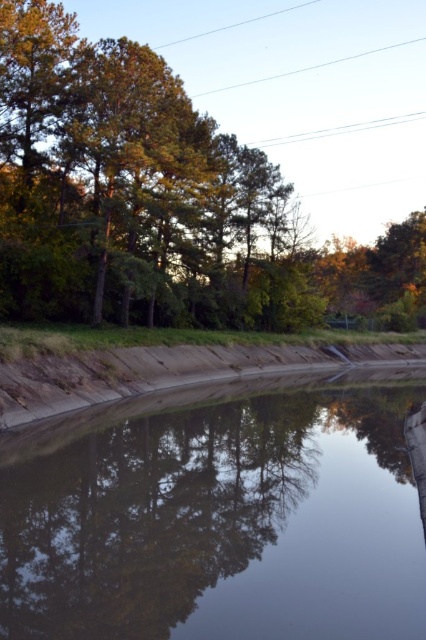
Based on the photo, you are standing at the edge of the waterway and want to take a photo of both the smooth reflective water at center and the green leafy tree at upper left. Which object will appear larger in your photo?

The smooth reflective water at center will appear larger in the photo because it is closer to the viewer than the green leafy tree at upper left.

You are standing on the concrete embankment and want to take a photo of the smooth reflective water at center. Where should you position yourself to capture the reflection clearly?

You should position yourself directly above the smooth reflective water at center at point (218, 515) to capture the reflection clearly.